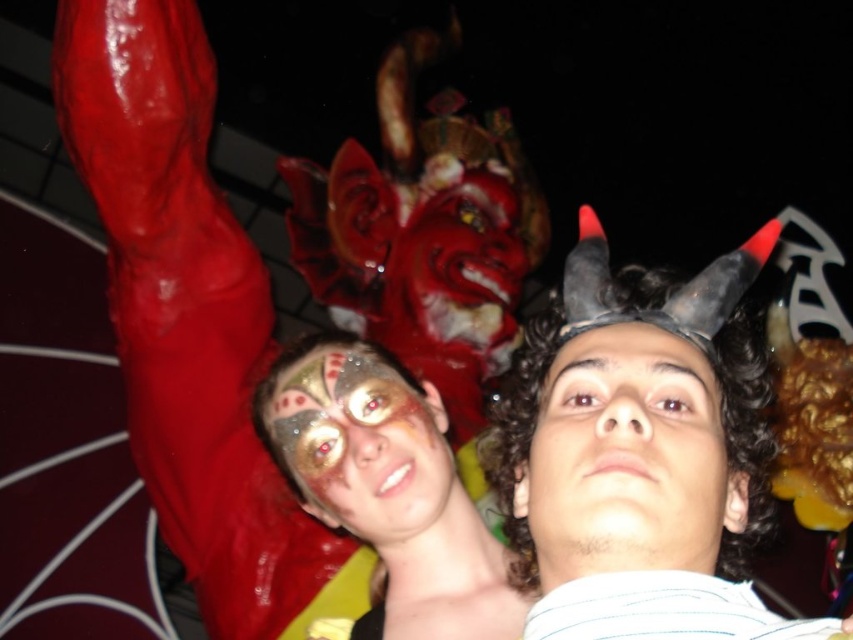
Question: Based on their relative distances, which object is farther from the smooth skin face at center?

Choices:
 (A) shiny gold face paint at center
 (B) matte gold face paint at center
 (C) black matte horns at upper center
 (D) glossy red latex at upper left

Answer: (D)

Question: Can you confirm if glossy red latex at upper left is bigger than matte gold face paint at center?

Choices:
 (A) no
 (B) yes

Answer: (B)

Question: Does glossy red latex at upper left appear over smooth skin face at center?

Choices:
 (A) yes
 (B) no

Answer: (A)

Question: Observing the image, what is the correct spatial positioning of black matte horns at upper center in reference to matte gold face paint at center?

Choices:
 (A) left
 (B) right

Answer: (B)

Question: Which object is farther from the camera taking this photo?

Choices:
 (A) smooth skin face at center
 (B) matte gold face paint at center
 (C) glossy red latex at upper left
 (D) shiny gold face paint at center

Answer: (C)

Question: Among these objects, which one is farthest from the camera?

Choices:
 (A) glossy red latex at upper left
 (B) matte gold face paint at center

Answer: (A)